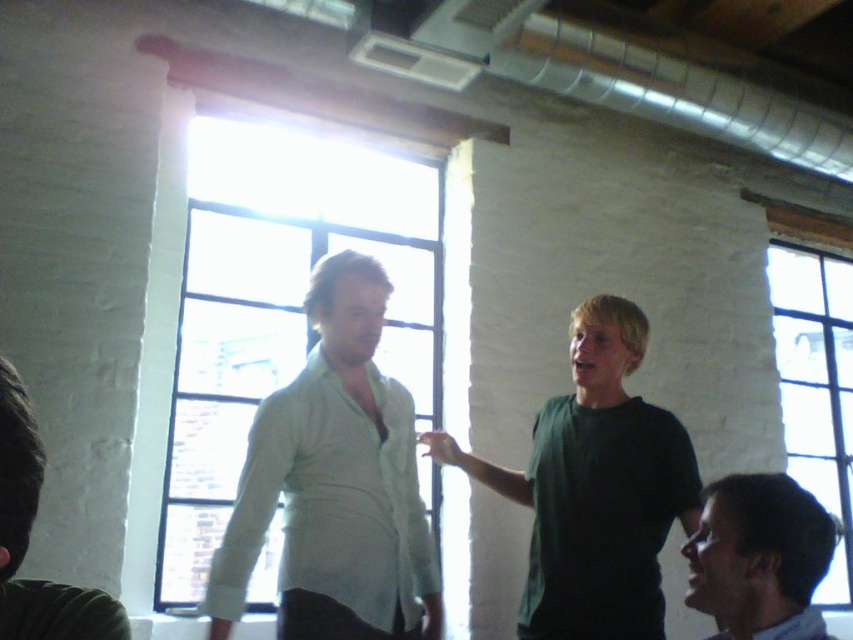
You are an interior designer assessing the room layout. You need to determine if the green matte shirt at center will be visible through the clear glass window at upper right when viewed from outside the room. Based on their relative heights, what do you conclude?

The green matte shirt at center has a lesser height compared to the clear glass window at upper right, so it will not be fully visible through the window from outside the room.